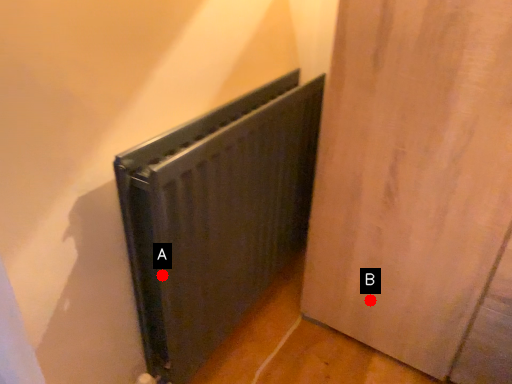
Question: Two points are circled on the image, labeled by A and B beside each circle. Which point is closer to the camera?

Choices:
 (A) A is closer
 (B) B is closer

Answer: (A)